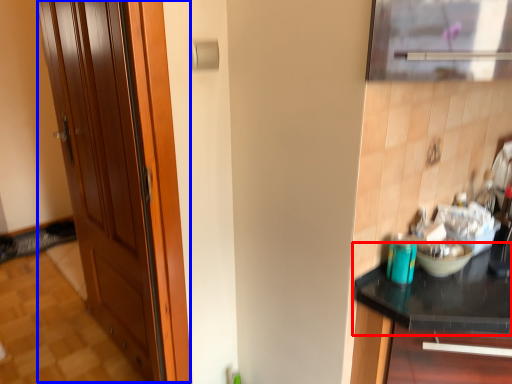
Question: Which of the following is the closest to the observer, countertop (highlighted by a red box) or door (highlighted by a blue box)?

Choices:
 (A) countertop
 (B) door

Answer: (A)